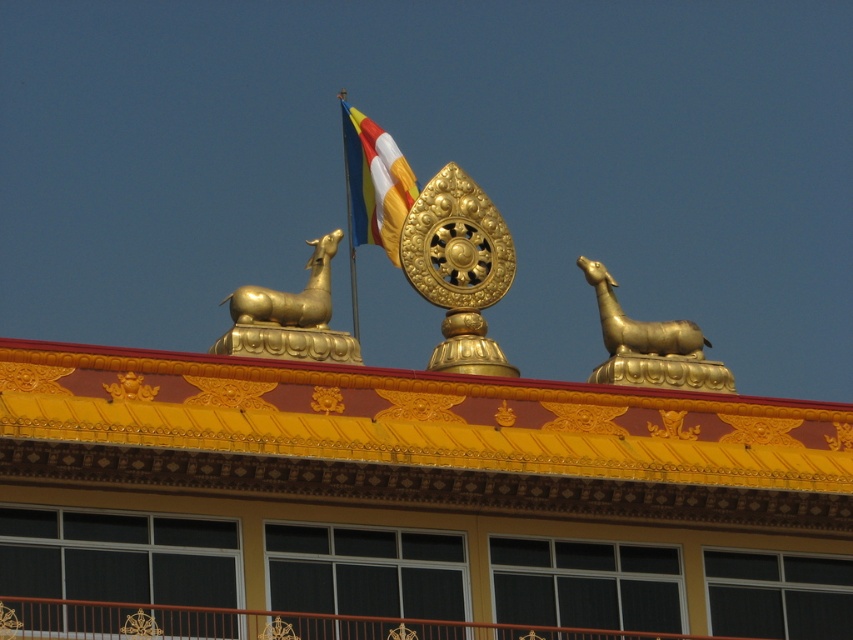
Question: Is gold polished statue at upper left bigger than gold polished deer at upper right?

Choices:
 (A) yes
 (B) no

Answer: (A)

Question: Estimate the real-world distances between objects in this image. Which object is closer to the gold polished deer at upper right?

Choices:
 (A) gold polished statue at upper left
 (B) tri-color fabric flag at upper center

Answer: (B)

Question: Does gold polished deer at upper right appear over tri-color fabric flag at upper center?

Choices:
 (A) yes
 (B) no

Answer: (B)

Question: Which is farther from the gold polished deer at upper right?

Choices:
 (A) tri-color fabric flag at upper center
 (B) gold polished statue at upper left

Answer: (B)

Question: Does gold polished statue at upper left appear on the left side of tri-color fabric flag at upper center?

Choices:
 (A) no
 (B) yes

Answer: (B)

Question: Which point appears farthest from the camera in this image?

Choices:
 (A) tap(381, 182)
 (B) tap(688, 355)
 (C) tap(310, 340)

Answer: (A)